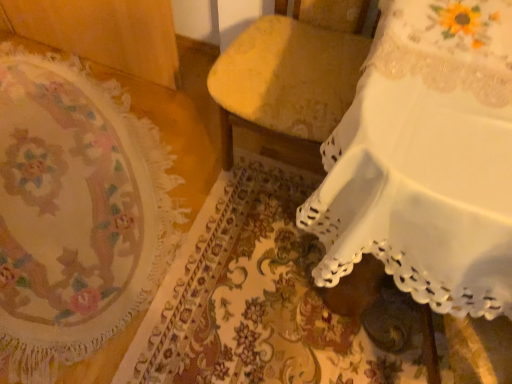
Question: From the image's perspective, does white lace tablecloth at upper right, which appears as the second furniture when viewed from the left, appear higher than velvet yellow chair at center, which ranks as the first furniture in left-to-right order?

Choices:
 (A) no
 (B) yes

Answer: (A)

Question: Is white lace tablecloth at upper right, the 1th furniture from the right, to the right of velvet yellow chair at center, which appears as the second furniture when viewed from the right, from the viewer's perspective?

Choices:
 (A) yes
 (B) no

Answer: (A)

Question: Considering the relative sizes of white lace tablecloth at upper right, the 1th furniture from the right, and velvet yellow chair at center, which ranks as the first furniture in left-to-right order, in the image provided, is white lace tablecloth at upper right, the 1th furniture from the right, thinner than velvet yellow chair at center, which ranks as the first furniture in left-to-right order,?

Choices:
 (A) yes
 (B) no

Answer: (B)

Question: From a real-world perspective, is white lace tablecloth at upper right, the 1th furniture from the right, physically above velvet yellow chair at center, which ranks as the first furniture in left-to-right order?

Choices:
 (A) yes
 (B) no

Answer: (B)

Question: Considering the relative sizes of white lace tablecloth at upper right, which appears as the second furniture when viewed from the left, and velvet yellow chair at center, which appears as the second furniture when viewed from the right, in the image provided, is white lace tablecloth at upper right, which appears as the second furniture when viewed from the left, smaller than velvet yellow chair at center, which appears as the second furniture when viewed from the right,?

Choices:
 (A) yes
 (B) no

Answer: (B)

Question: Visually, is floral tapestry at left positioned to the left or to the right of velvet yellow chair at center, which ranks as the first furniture in left-to-right order?

Choices:
 (A) left
 (B) right

Answer: (A)

Question: From a real-world perspective, is floral tapestry at left above or below velvet yellow chair at center, which ranks as the first furniture in left-to-right order?

Choices:
 (A) above
 (B) below

Answer: (B)

Question: Is point (29, 326) closer or farther from the camera than point (348, 51)?

Choices:
 (A) farther
 (B) closer

Answer: (B)

Question: Considering the positions of floral tapestry at left and velvet yellow chair at center, which ranks as the first furniture in left-to-right order, in the image, is floral tapestry at left taller or shorter than velvet yellow chair at center, which ranks as the first furniture in left-to-right order,?

Choices:
 (A) short
 (B) tall

Answer: (A)

Question: Would you say white lace tablecloth at upper right, which appears as the second furniture when viewed from the left, is to the left or to the right of velvet yellow chair at center, which ranks as the first furniture in left-to-right order, in the picture?

Choices:
 (A) right
 (B) left

Answer: (A)

Question: From the image's perspective, is white lace tablecloth at upper right, the 1th furniture from the right, positioned above or below velvet yellow chair at center, which appears as the second furniture when viewed from the right?

Choices:
 (A) below
 (B) above

Answer: (A)

Question: Considering the positions of white lace tablecloth at upper right, which appears as the second furniture when viewed from the left, and velvet yellow chair at center, which appears as the second furniture when viewed from the right, in the image, is white lace tablecloth at upper right, which appears as the second furniture when viewed from the left, taller or shorter than velvet yellow chair at center, which appears as the second furniture when viewed from the right,?

Choices:
 (A) tall
 (B) short

Answer: (B)

Question: Considering their positions, is white lace tablecloth at upper right, which appears as the second furniture when viewed from the left, located in front of or behind velvet yellow chair at center, which appears as the second furniture when viewed from the right?

Choices:
 (A) behind
 (B) front

Answer: (B)

Question: Is white lace tablecloth at upper right, which appears as the second furniture when viewed from the left, inside or outside of floral tapestry at left?

Choices:
 (A) inside
 (B) outside

Answer: (B)

Question: Is white lace tablecloth at upper right, the 1th furniture from the right, wider or thinner than floral tapestry at left?

Choices:
 (A) thin
 (B) wide

Answer: (A)